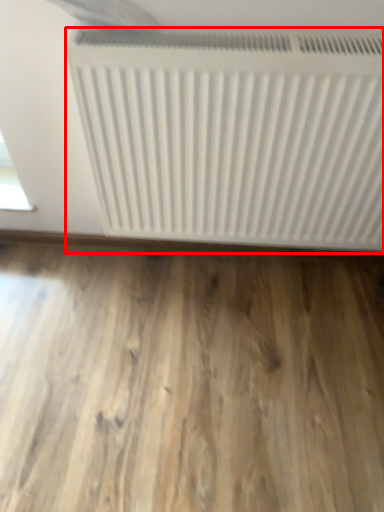
Question: From the image's perspective, considering the relative positions of radiator (annotated by the red box) and hardwood in the image provided, where is radiator (annotated by the red box) located with respect to the staircase?

Choices:
 (A) below
 (B) above

Answer: (B)